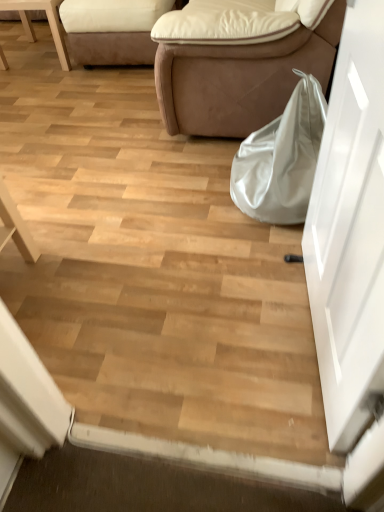
Question: Is the depth of white glossy door at right less than that of satin white bag at lower right?

Choices:
 (A) no
 (B) yes

Answer: (B)

Question: From a real-world perspective, is white glossy door at right over satin white bag at lower right?

Choices:
 (A) no
 (B) yes

Answer: (B)

Question: Can you confirm if white glossy door at right is positioned to the right of satin white bag at lower right?

Choices:
 (A) no
 (B) yes

Answer: (B)

Question: Does white glossy door at right have a greater width compared to satin white bag at lower right?

Choices:
 (A) no
 (B) yes

Answer: (A)

Question: Does white glossy door at right contain satin white bag at lower right?

Choices:
 (A) yes
 (B) no

Answer: (B)

Question: From the image's perspective, is white glossy door at right above satin white bag at lower right?

Choices:
 (A) no
 (B) yes

Answer: (A)

Question: Does white glossy door at right have a smaller size compared to white leather chair at upper left?

Choices:
 (A) no
 (B) yes

Answer: (B)

Question: From a real-world perspective, is white glossy door at right on top of white leather chair at upper left?

Choices:
 (A) no
 (B) yes

Answer: (B)

Question: Does white glossy door at right lie behind white leather chair at upper left?

Choices:
 (A) yes
 (B) no

Answer: (B)

Question: Can you confirm if white glossy door at right is positioned to the left of white leather chair at upper left?

Choices:
 (A) no
 (B) yes

Answer: (A)

Question: Is white glossy door at right to the right of white leather chair at upper left from the viewer's perspective?

Choices:
 (A) yes
 (B) no

Answer: (A)

Question: From a real-world perspective, is white glossy door at right beneath white leather chair at upper left?

Choices:
 (A) yes
 (B) no

Answer: (B)

Question: Does suede beige studio couch at upper left, the first studio couch in the left-to-right sequence, have a greater width compared to brown leather couch at center, which is the first studio couch in right-to-left order?

Choices:
 (A) yes
 (B) no

Answer: (B)